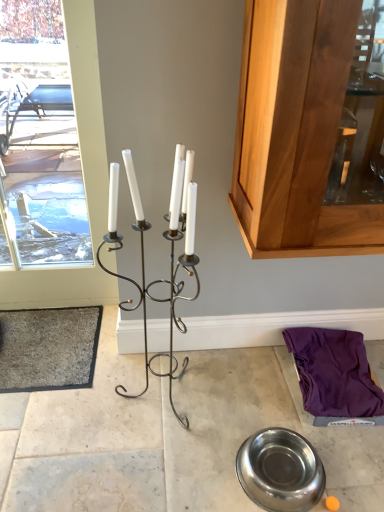
At what (x,y) coordinates should I click in order to perform the action: click on vacant region above metallic silver bowl at lower center (from a real-world perspective). Please return your answer as a coordinate pair (x, y). Image resolution: width=384 pixels, height=512 pixels. Looking at the image, I should click on (172, 401).